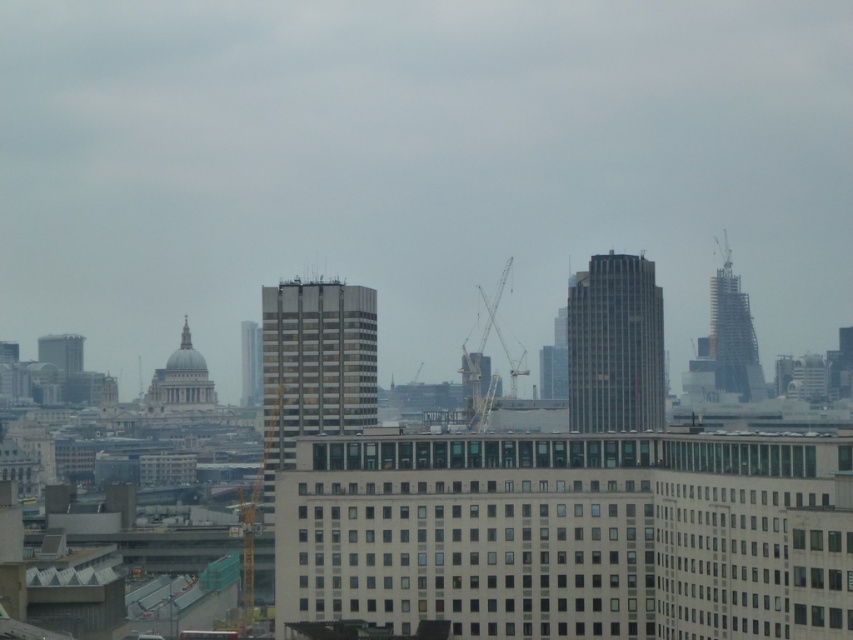
You are a tourist standing in the city and want to take a photo of both the matte glass building at center and the white marble dome at center. Based on their positions, which one should you frame first in your camera viewfinder to ensure both are in the shot?

The matte glass building at center is positioned on the right side of white marble dome at center, so you should frame the white marble dome at center first to ensure both are included in the shot since it is on the left and the matte glass building at center is to its right.

You are standing at the city square and see the matte glass building at center and the smooth glass skyscraper at center. Which one appears taller to you?

The matte glass building at center appears taller than the smooth glass skyscraper at center.